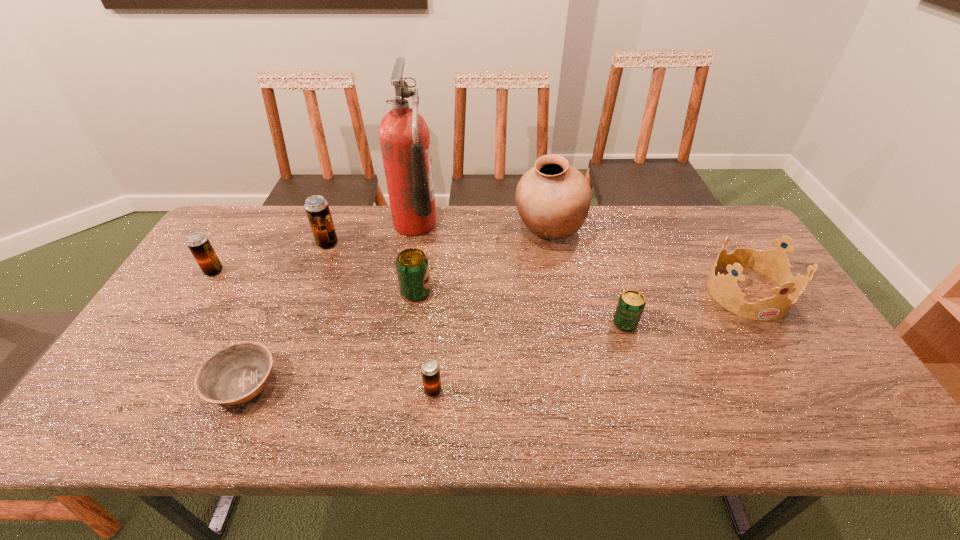
Image resolution: width=960 pixels, height=540 pixels. In order to click on beer can that is the third nearest to the leftmost object in this screenshot , I will do `click(430, 370)`.

The width and height of the screenshot is (960, 540). Find the location of `black beer can that is the second closest one to the tiara`. black beer can that is the second closest one to the tiara is located at coordinates (317, 209).

This screenshot has height=540, width=960. What are the coordinates of `black beer can that can be found as the third closest to the second tallest object` in the screenshot? It's located at (198, 243).

You are a GUI agent. You are given a task and a screenshot of the screen. Output one action in this format:
    pyautogui.click(x=<x>, y=<y>)
    Task: Click on the vacant space that satisfies the following two spatial constraints: 1. on the back side of the nearest black beer can; 2. on the front of the tallest object near the operation label
    The width and height of the screenshot is (960, 540).
    Given the screenshot: What is the action you would take?
    pyautogui.click(x=447, y=224)

Where is `vacant space that satisfies the following two spatial constraints: 1. on the front of the red fire extinguisher near the operation label; 2. on the front side of the leftmost beer can`? This screenshot has width=960, height=540. vacant space that satisfies the following two spatial constraints: 1. on the front of the red fire extinguisher near the operation label; 2. on the front side of the leftmost beer can is located at coordinates (407, 271).

Identify the location of vacant space that satisfies the following two spatial constraints: 1. on the front of the red fire extinguisher near the operation label; 2. on the front side of the shortest object. The height and width of the screenshot is (540, 960). (387, 384).

At what (x,y) coordinates should I click in order to perform the action: click on vacant region that satisfies the following two spatial constraints: 1. on the front side of the third beer can from left to right; 2. on the right side of the biggest black beer can. Please return your answer as a coordinate pair (x, y). This screenshot has height=540, width=960. Looking at the image, I should click on (309, 292).

What are the coordinates of `free space that satisfies the following two spatial constraints: 1. on the back side of the fourth beer can from left to right; 2. on the front of the tallest object near the operation label` in the screenshot? It's located at (447, 224).